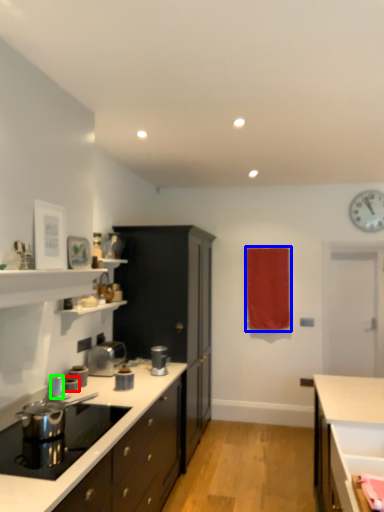
Question: Estimate the real-world distances between objects in this image. Which object is farther from kitchen appliance (highlighted by a red box), curtain (highlighted by a blue box) or kitchen appliance (highlighted by a green box)?

Choices:
 (A) curtain
 (B) kitchen appliance

Answer: (A)